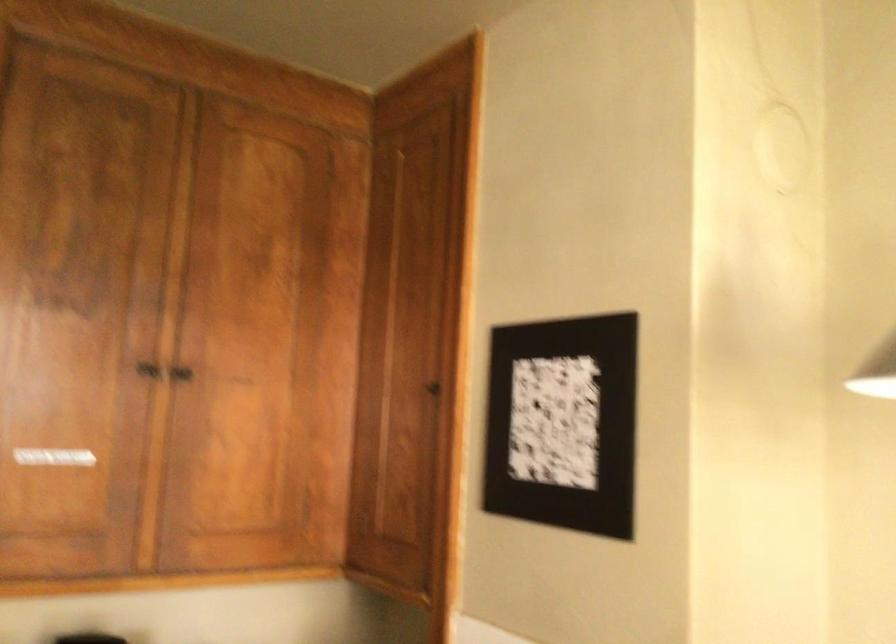
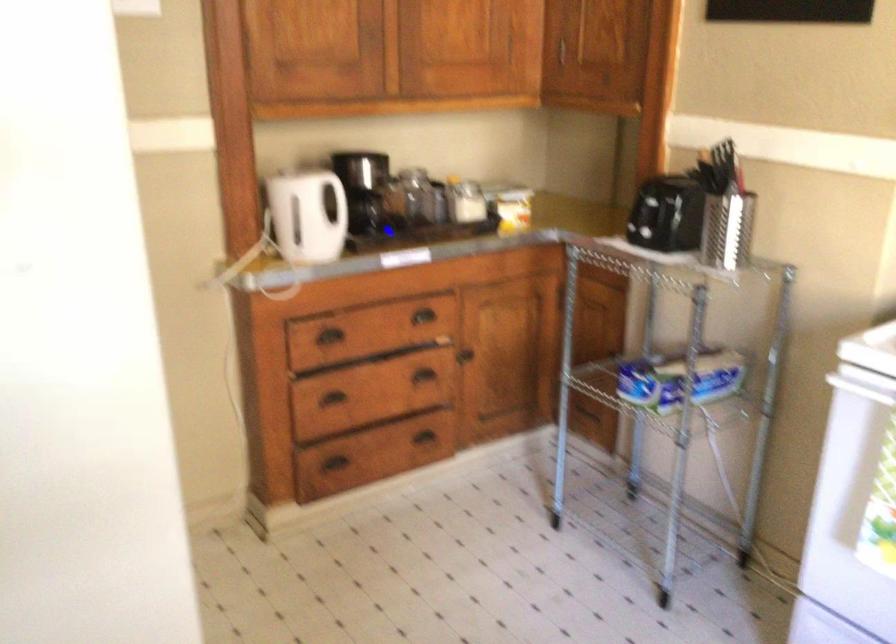
Which direction would the cameraman need to move to produce the second image?

The movement direction of the cameraman is left, backward.